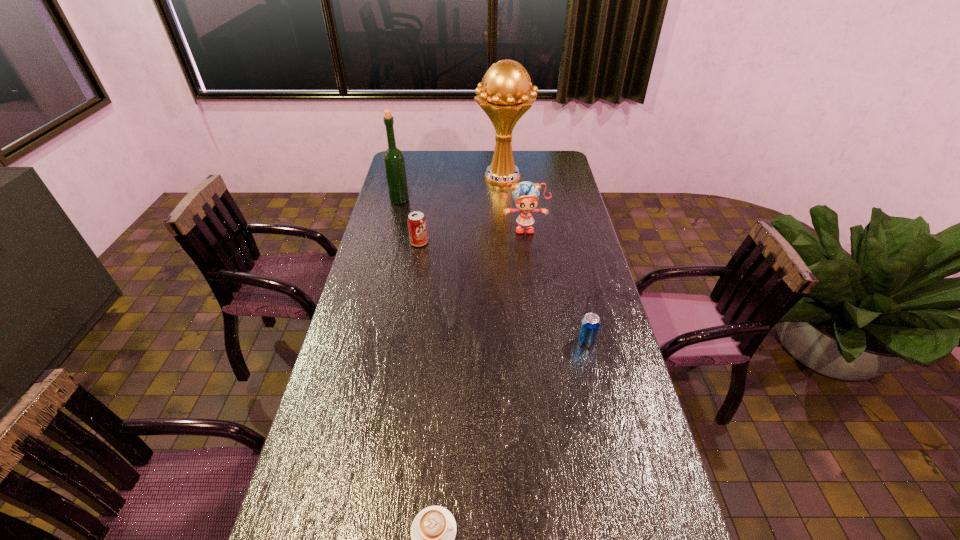
You are a GUI agent. You are given a task and a screenshot of the screen. Output one action in this format:
    pyautogui.click(x=<x>, y=<y>)
    Task: Click on the blank space at the far edge
    The width and height of the screenshot is (960, 540).
    Given the screenshot: What is the action you would take?
    pyautogui.click(x=446, y=163)

Find the location of a particular element. This screenshot has height=540, width=960. free location at the left edge of the desktop is located at coordinates (366, 389).

Identify the location of free space at the right edge. This screenshot has width=960, height=540. (569, 189).

The image size is (960, 540). I want to click on free spot between the fifth farthest object and the second object from left to right, so click(503, 292).

What are the coordinates of `free space that is in between the fifth shortest object and the tallest object` in the screenshot? It's located at (451, 189).

At what (x,y) coordinates should I click in order to perform the action: click on vacant space that is in between the liquor and the doll. Please return your answer as a coordinate pair (x, y). This screenshot has height=540, width=960. Looking at the image, I should click on (462, 214).

Locate an element on the screen. free space between the doll and the tallest object is located at coordinates (514, 203).

Image resolution: width=960 pixels, height=540 pixels. Find the location of `vacant area that lies between the second nearest object and the leftmost object`. vacant area that lies between the second nearest object and the leftmost object is located at coordinates (492, 271).

The width and height of the screenshot is (960, 540). I want to click on empty space between the third farthest object and the trophy_cup, so click(x=514, y=203).

Select which object appears as the third closest to the second object from left to right. Please provide its 2D coordinates. Your answer should be formatted as a tuple, i.e. [(x, y)], where the tuple contains the x and y coordinates of a point satisfying the conditions above.

[(503, 94)]